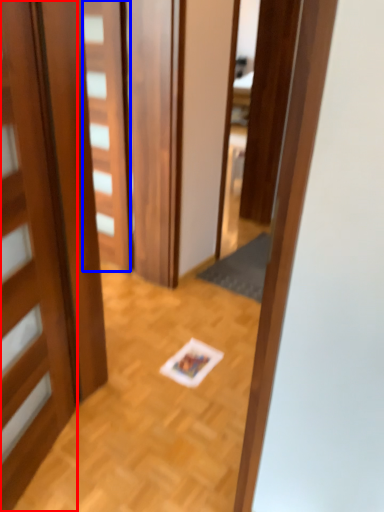
Question: Which object is closer to the camera taking this photo, door (highlighted by a red box) or door (highlighted by a blue box)?

Choices:
 (A) door
 (B) door

Answer: (A)